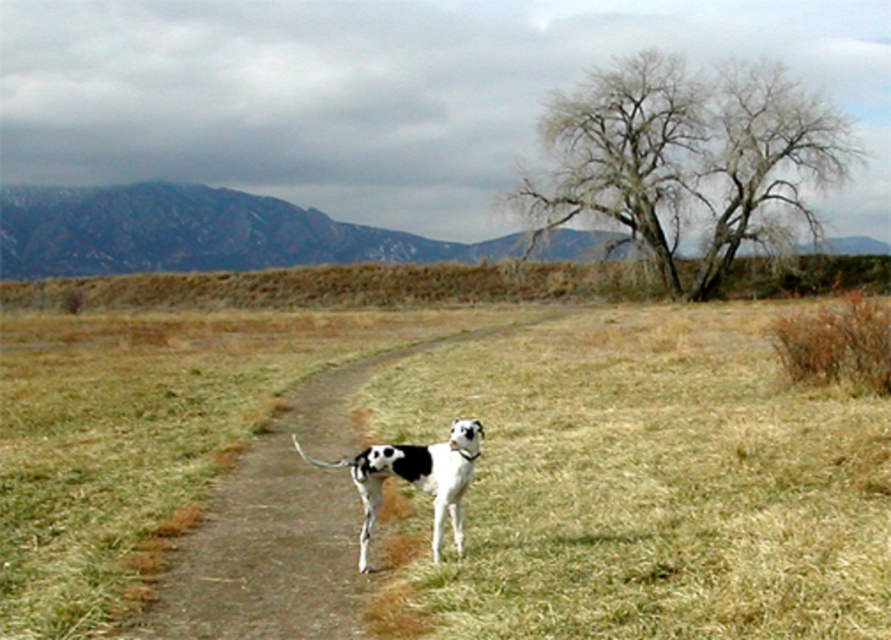
Who is positioned more to the left, white smooth dog at center or white-spotted fur dog at center?

Positioned to the left is white smooth dog at center.

Image resolution: width=891 pixels, height=640 pixels. What do you see at coordinates (284, 524) in the screenshot?
I see `white smooth dog at center` at bounding box center [284, 524].

Is point (219, 621) positioned after point (443, 442)?

That is False.

Image resolution: width=891 pixels, height=640 pixels. Find the location of `white smooth dog at center`. white smooth dog at center is located at coordinates (284, 524).